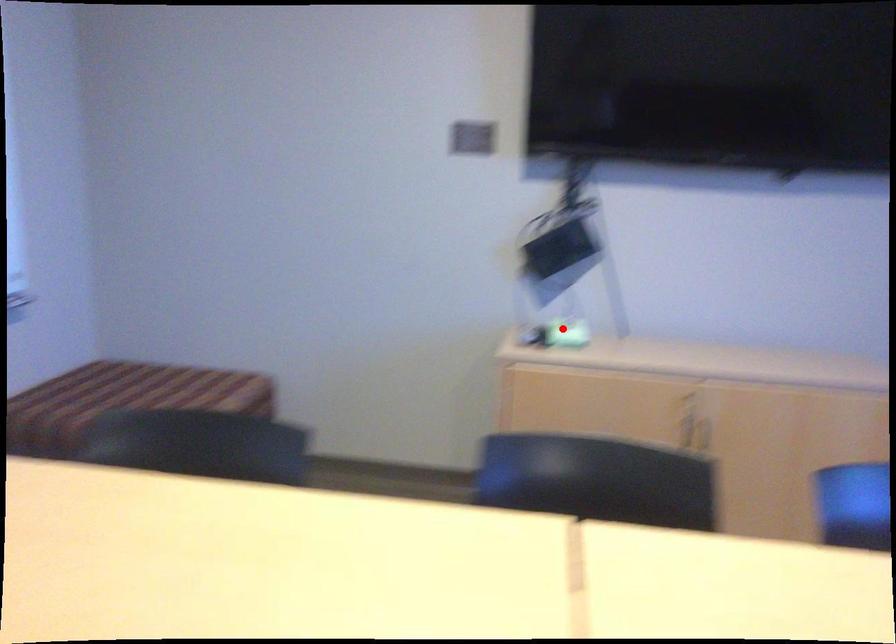
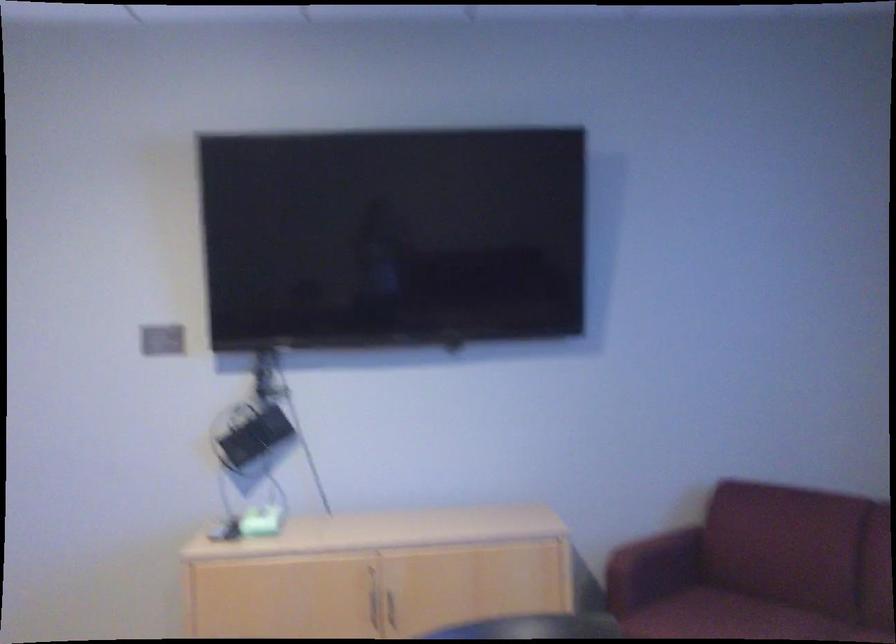
Locate, in the second image, the point that corresponds to the highlighted location in the first image.

(257, 522)